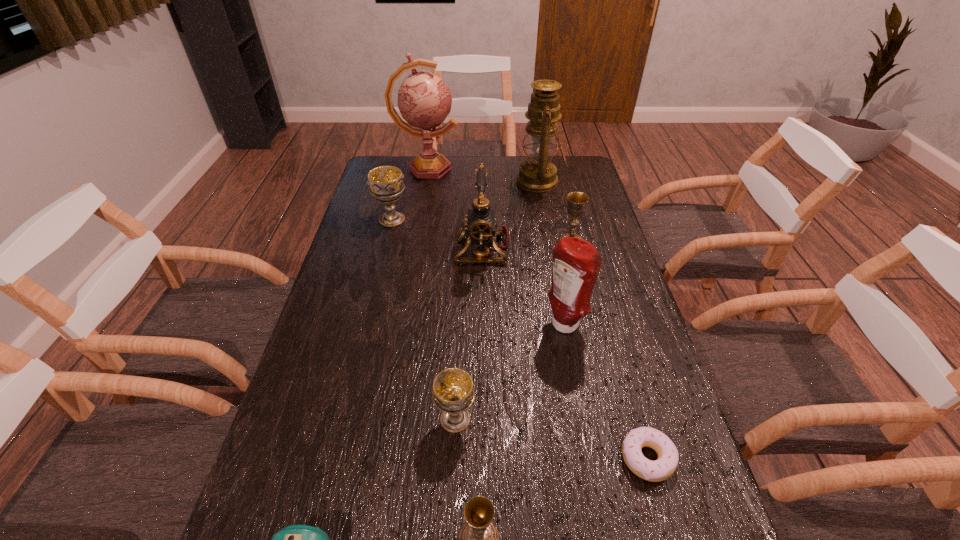
Image resolution: width=960 pixels, height=540 pixels. I want to click on unoccupied area between the sixth farthest object and the oil lamp, so click(x=552, y=254).

The height and width of the screenshot is (540, 960). Find the location of `free area in between the red condiment and the oil lamp`. free area in between the red condiment and the oil lamp is located at coordinates (552, 254).

At what (x,y) coordinates should I click in order to perform the action: click on free space between the nearer white chalice and the leftmost chalice. Please return your answer as a coordinate pair (x, y). This screenshot has height=540, width=960. Looking at the image, I should click on [423, 319].

Where is `free space between the left white chalice and the white doughnut`? This screenshot has width=960, height=540. free space between the left white chalice and the white doughnut is located at coordinates (519, 339).

The image size is (960, 540). Identify the location of free space between the black telephone and the sixth farthest object. (523, 287).

You are a GUI agent. You are given a task and a screenshot of the screen. Output one action in this format:
    pyautogui.click(x=<x>, y=<y>)
    Task: Click on the object that is the third closest to the right gold chalice
    Image resolution: width=960 pixels, height=540 pixels.
    Given the screenshot: What is the action you would take?
    pyautogui.click(x=576, y=262)

Identify which object is located as the seventh nearest to the blue alarm clock. Please provide its 2D coordinates. Your answer should be formatted as a tuple, i.e. [(x, y)], where the tuple contains the x and y coordinates of a point satisfying the conditions above.

[(577, 201)]

Select which chalice is the third closest to the red condiment. Please provide its 2D coordinates. Your answer should be formatted as a tuple, i.e. [(x, y)], where the tuple contains the x and y coordinates of a point satisfying the conditions above.

[(477, 539)]

Identify which chalice is the second nearest to the farthest chalice. Please provide its 2D coordinates. Your answer should be formatted as a tuple, i.e. [(x, y)], where the tuple contains the x and y coordinates of a point satisfying the conditions above.

[(453, 393)]

Locate an element on the screen. Image resolution: width=960 pixels, height=540 pixels. free spot that satisfies the following two spatial constraints: 1. on the back side of the bigger white chalice; 2. on the left side of the oil lamp is located at coordinates (401, 181).